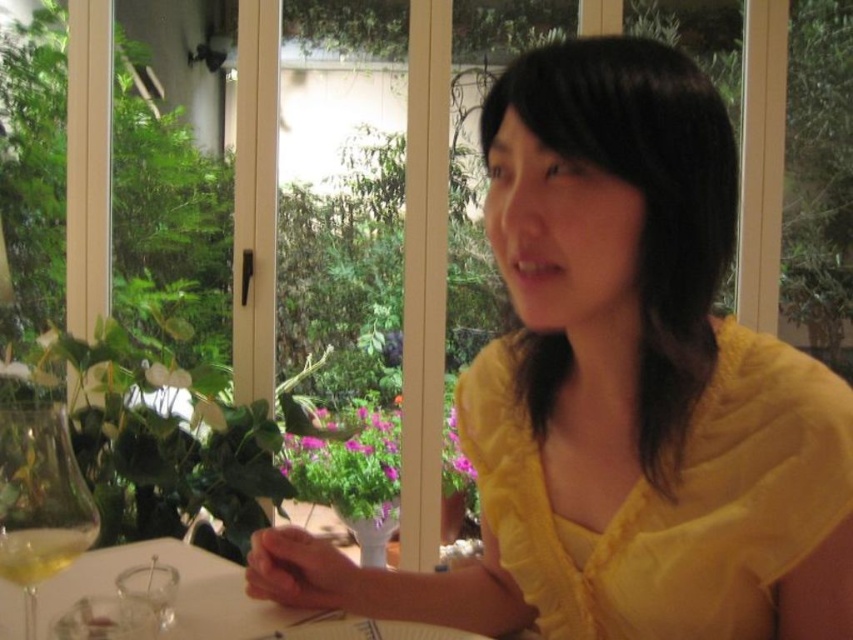
You are standing at the position of the person in the scene. There are two points marked in the image. The first point is at coordinates point (653,632) and the second is at point (198,548). If you were to reach out to touch both points, which one would you need to reach forward more towards, and which one would require reaching less? Please explain based on their positions relative to your body.

Based on the coordinates provided, point (653,632) is in front of point (198,548). Therefore, to touch both points while standing at the person position, you would need to reach forward more towards point (653,632) since it is closer to your body. Conversely, point (198,548) would require reaching less as it is further away from your current position.

You are a fashion designer who wants to place a new accessory between the yellow cotton dress at center and the clear glass wine glass at lower left. What is the minimum distance you need to maintain between them to ensure the accessory fits comfortably?

The minimum distance required to place an accessory between the yellow cotton dress at center and the clear glass wine glass at lower left is 46.30 centimeters, as that is the current distance between them.